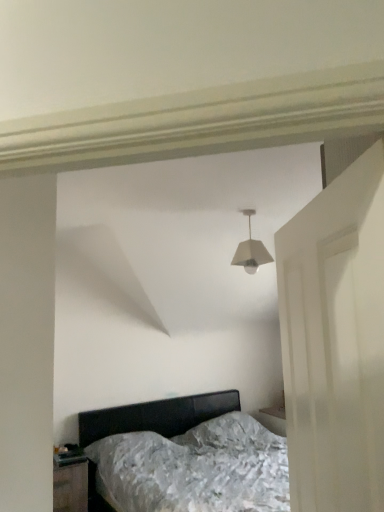
Question: Does white matte lampshade at center turn towards metallic silver bed at center?

Choices:
 (A) no
 (B) yes

Answer: (A)

Question: Is white matte lampshade at center far from metallic silver bed at center?

Choices:
 (A) no
 (B) yes

Answer: (B)

Question: Considering the relative sizes of white matte lampshade at center and metallic silver bed at center in the image provided, is white matte lampshade at center bigger than metallic silver bed at center?

Choices:
 (A) yes
 (B) no

Answer: (B)

Question: Is white matte lampshade at center to the right of metallic silver bed at center from the viewer's perspective?

Choices:
 (A) yes
 (B) no

Answer: (A)

Question: Is white matte lampshade at center smaller than metallic silver bed at center?

Choices:
 (A) no
 (B) yes

Answer: (B)

Question: Considering the positions of white matte door at right and black glossy nightstand at lower left in the image, is white matte door at right taller or shorter than black glossy nightstand at lower left?

Choices:
 (A) short
 (B) tall

Answer: (B)

Question: From the image's perspective, is white matte door at right above or below black glossy nightstand at lower left?

Choices:
 (A) below
 (B) above

Answer: (B)

Question: Is white matte door at right spatially inside black glossy nightstand at lower left, or outside of it?

Choices:
 (A) inside
 (B) outside

Answer: (B)

Question: In the image, is white matte door at right positioned in front of or behind black glossy nightstand at lower left?

Choices:
 (A) behind
 (B) front

Answer: (B)

Question: Does point (69, 502) appear closer or farther from the camera than point (326, 273)?

Choices:
 (A) farther
 (B) closer

Answer: (A)

Question: Is black glossy nightstand at lower left taller or shorter than white matte door at right?

Choices:
 (A) short
 (B) tall

Answer: (A)

Question: Is black glossy nightstand at lower left bigger or smaller than white matte door at right?

Choices:
 (A) big
 (B) small

Answer: (A)

Question: From a real-world perspective, is black glossy nightstand at lower left physically located above or below white matte door at right?

Choices:
 (A) below
 (B) above

Answer: (A)

Question: From a real-world perspective, is white matte door at right physically located above or below white matte lampshade at center?

Choices:
 (A) below
 (B) above

Answer: (A)

Question: In terms of size, does white matte door at right appear bigger or smaller than white matte lampshade at center?

Choices:
 (A) small
 (B) big

Answer: (B)